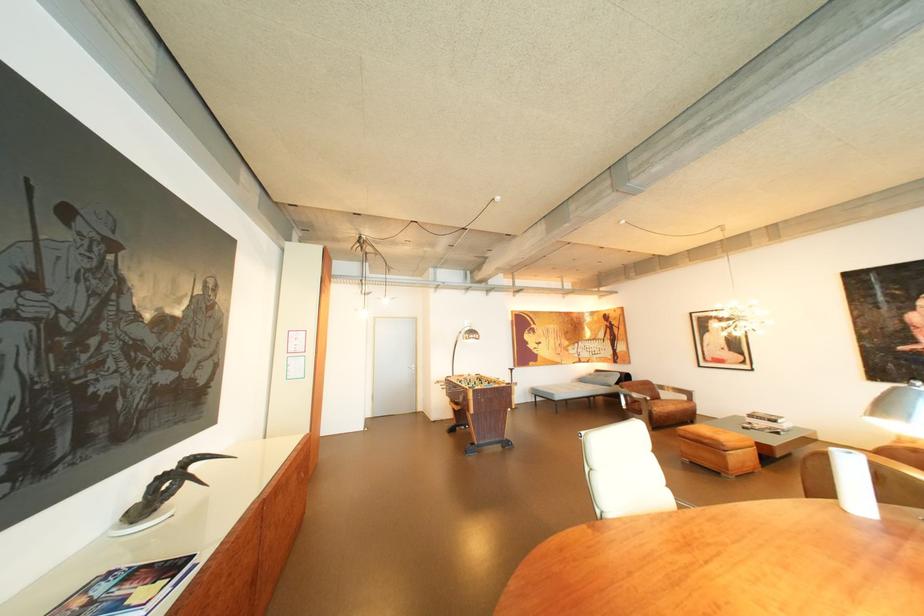
Where would you adjust the silver lamp shade? Please return your answer as a coordinate pair (x, y).

(897, 405)